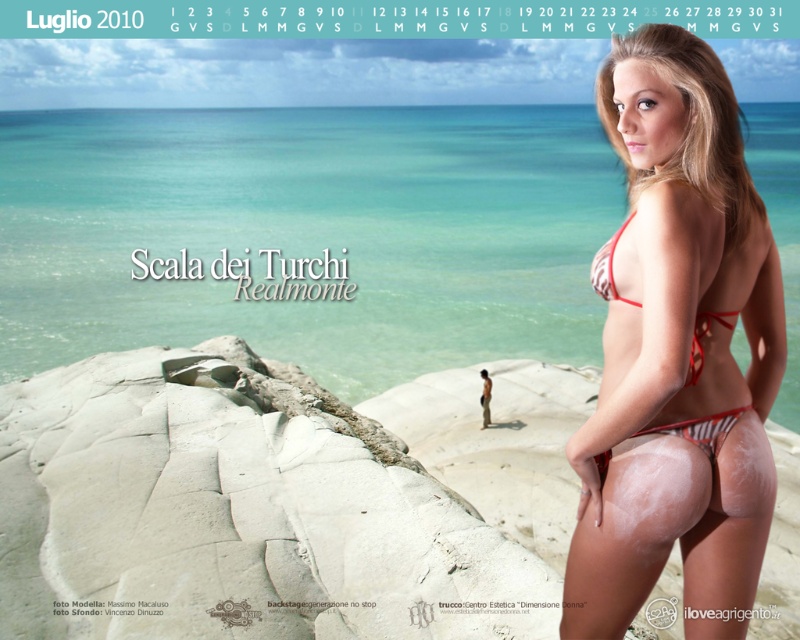
You are a photographer planning to capture the scene from the calendar cover. You notice the transparent water at center and the red bikini at right. Which object is located to the right of the other?

The red bikini at right is located to the right of the transparent water at center.

You are a photographer trying to capture the best angle of the two points marked in the image. Which point, point (192, 301) or point (713, 451), is closer to the camera?

Point (192, 301) is further to the camera than point (713, 451), so the closer point to the camera is point (713, 451).